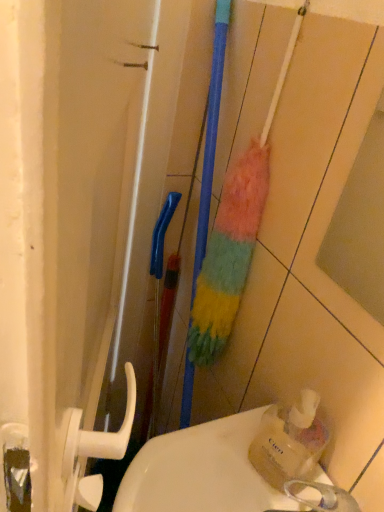
Question: Are translucent plastic soap dispenser at lower right and white glossy sink at lower center making contact?

Choices:
 (A) no
 (B) yes

Answer: (B)

Question: Is translucent plastic soap dispenser at lower right thinner than white glossy sink at lower center?

Choices:
 (A) no
 (B) yes

Answer: (B)

Question: Is translucent plastic soap dispenser at lower right at the left side of white glossy sink at lower center?

Choices:
 (A) no
 (B) yes

Answer: (A)

Question: Is translucent plastic soap dispenser at lower right facing away from white glossy sink at lower center?

Choices:
 (A) no
 (B) yes

Answer: (A)

Question: From the image's perspective, does translucent plastic soap dispenser at lower right appear higher than white glossy sink at lower center?

Choices:
 (A) no
 (B) yes

Answer: (B)

Question: Does translucent plastic soap dispenser at lower right have a lesser height compared to white glossy sink at lower center?

Choices:
 (A) yes
 (B) no

Answer: (B)

Question: Does multicolored fuzzy brush at center come behind translucent plastic soap dispenser at lower right?

Choices:
 (A) yes
 (B) no

Answer: (A)

Question: Considering the relative positions of multicolored fuzzy brush at center and translucent plastic soap dispenser at lower right in the image provided, is multicolored fuzzy brush at center to the right of translucent plastic soap dispenser at lower right from the viewer's perspective?

Choices:
 (A) yes
 (B) no

Answer: (B)

Question: Is translucent plastic soap dispenser at lower right inside multicolored fuzzy brush at center?

Choices:
 (A) yes
 (B) no

Answer: (B)

Question: Is multicolored fuzzy brush at center next to translucent plastic soap dispenser at lower right and touching it?

Choices:
 (A) no
 (B) yes

Answer: (A)

Question: Considering the relative sizes of multicolored fuzzy brush at center and translucent plastic soap dispenser at lower right in the image provided, is multicolored fuzzy brush at center smaller than translucent plastic soap dispenser at lower right?

Choices:
 (A) no
 (B) yes

Answer: (A)

Question: Can you confirm if multicolored fuzzy brush at center is thinner than translucent plastic soap dispenser at lower right?

Choices:
 (A) no
 (B) yes

Answer: (A)

Question: Is white glossy sink at lower center oriented towards multicolored fuzzy brush at center?

Choices:
 (A) no
 (B) yes

Answer: (A)